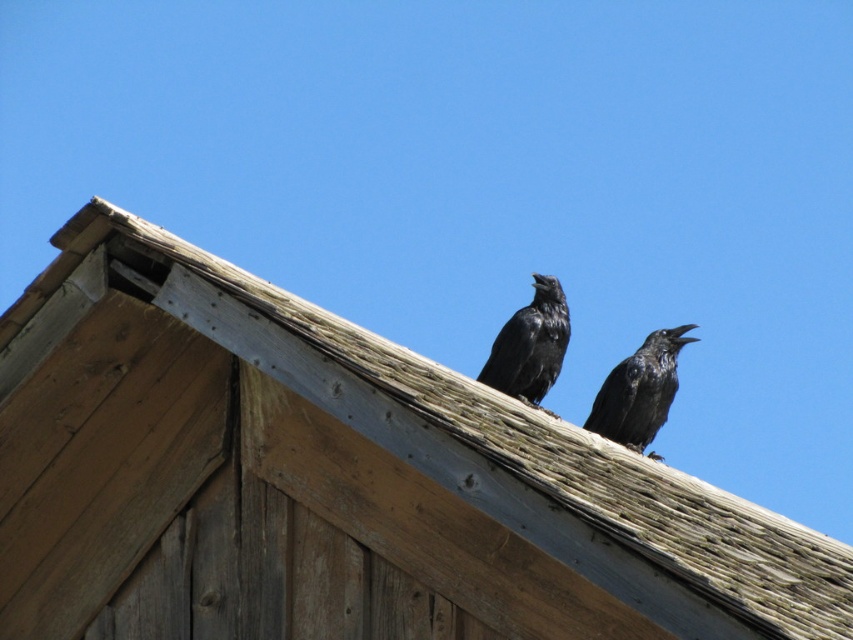
Can you confirm if wooden shingles at upper center is positioned below shiny black raven at center?

Indeed, wooden shingles at upper center is positioned under shiny black raven at center.

Locate an element on the screen. This screenshot has width=853, height=640. wooden shingles at upper center is located at coordinates (335, 481).

What do you see at coordinates (335, 481) in the screenshot? Image resolution: width=853 pixels, height=640 pixels. I see `wooden shingles at upper center` at bounding box center [335, 481].

At what (x,y) coordinates should I click in order to perform the action: click on wooden shingles at upper center. Please return your answer as a coordinate pair (x, y). Looking at the image, I should click on (335, 481).

Is wooden shingles at upper center above shiny black raven at upper right?

No.

Who is higher up, wooden shingles at upper center or shiny black raven at upper right?

shiny black raven at upper right

Where is `wooden shingles at upper center`? This screenshot has height=640, width=853. wooden shingles at upper center is located at coordinates (335, 481).

Can you confirm if shiny black raven at upper right is thinner than shiny black raven at center?

In fact, shiny black raven at upper right might be wider than shiny black raven at center.

Between point (670, 380) and point (525, 337), which one is positioned behind?

The point (670, 380) is behind.

Locate an element on the screen. The image size is (853, 640). shiny black raven at upper right is located at coordinates (639, 390).

Locate an element on the screen. shiny black raven at upper right is located at coordinates (639, 390).